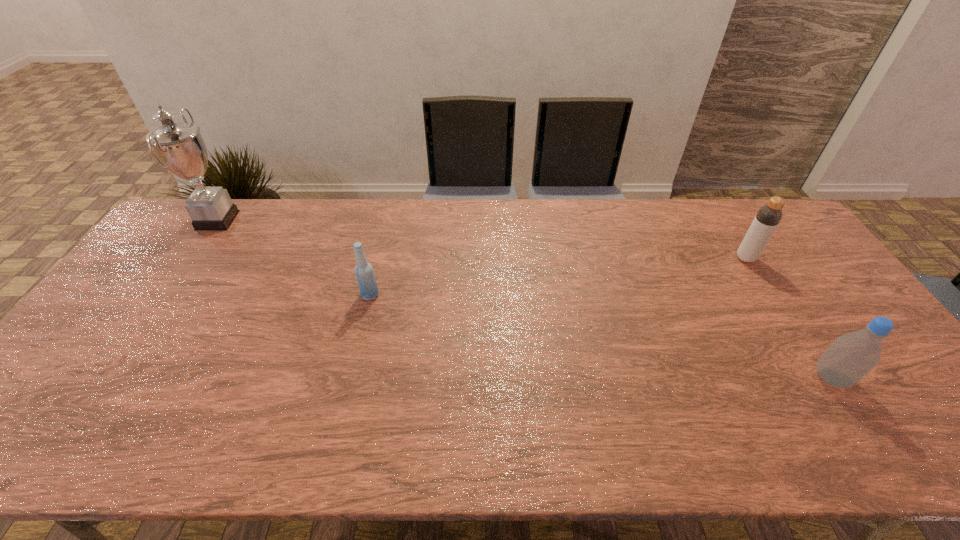
At what (x,y) coordinates should I click in order to perform the action: click on vacant area between the second nearest object and the nearest object. Please return your answer as a coordinate pair (x, y). Looking at the image, I should click on (x=600, y=336).

What are the coordinates of `vacant space in between the nearest bottle and the tallest object` in the screenshot? It's located at (524, 299).

The width and height of the screenshot is (960, 540). Identify the location of blank region between the second object from left to right and the farthest object. (294, 258).

Locate an element on the screen. The height and width of the screenshot is (540, 960). free spot between the third nearest object and the leftmost bottle is located at coordinates (558, 276).

Locate an element on the screen. vacant point located between the second farthest object and the nearest bottle is located at coordinates (788, 318).

Find the location of `free space between the tallest object and the nearest bottle`. free space between the tallest object and the nearest bottle is located at coordinates (524, 299).

Where is `blank region between the nearest bottle and the third nearest object`? The height and width of the screenshot is (540, 960). blank region between the nearest bottle and the third nearest object is located at coordinates [788, 318].

This screenshot has width=960, height=540. I want to click on free space between the farthest bottle and the trophy cup, so click(482, 239).

Locate which object ranks second in proximity to the trophy cup. Please provide its 2D coordinates. Your answer should be formatted as a tuple, i.e. [(x, y)], where the tuple contains the x and y coordinates of a point satisfying the conditions above.

[(768, 217)]

The width and height of the screenshot is (960, 540). Identify the location of the third closest object to the farthest bottle. (181, 150).